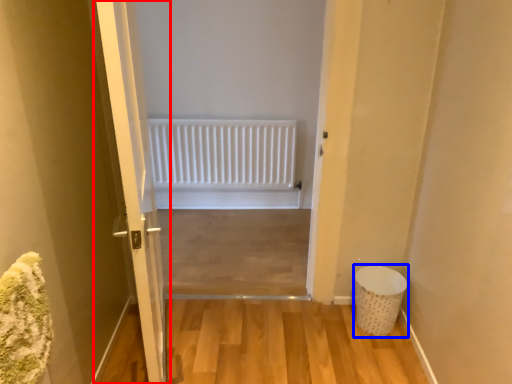
Question: Which point is further to the camera, door (highlighted by a red box) or laundry basket (highlighted by a blue box)?

Choices:
 (A) door
 (B) laundry basket

Answer: (B)